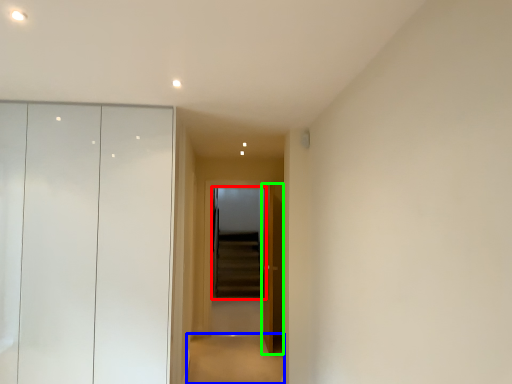
Question: Which object is positioned closest to screen door (highlighted by a red box)? Select from path (highlighted by a blue box) and door (highlighted by a green box).

Choices:
 (A) path
 (B) door

Answer: (A)